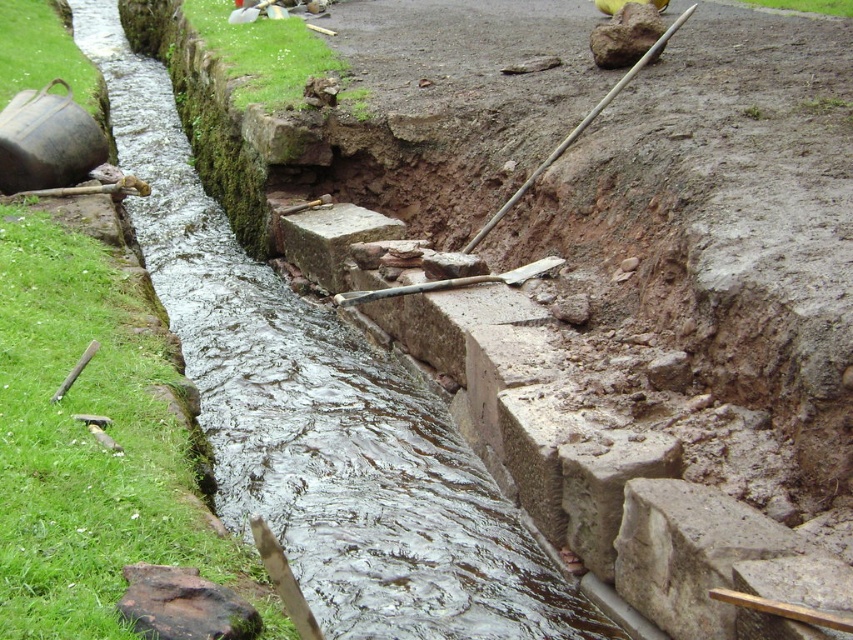
Question: Can you confirm if smooth wooden shovel at upper right is positioned to the right of wooden shovel at center?

Choices:
 (A) no
 (B) yes

Answer: (B)

Question: Which object appears closest to the camera in this image?

Choices:
 (A) wet concrete stream at center
 (B) wooden shovel at center

Answer: (A)

Question: Can you confirm if smooth wooden shovel at upper right is smaller than wooden shovel at center?

Choices:
 (A) yes
 (B) no

Answer: (A)

Question: Estimate the real-world distances between objects in this image. Which object is farther from the wooden shovel at center?

Choices:
 (A) smooth wooden shovel at upper right
 (B) wet concrete stream at center

Answer: (A)

Question: Which object is closer to the camera taking this photo?

Choices:
 (A) wet concrete stream at center
 (B) smooth wooden shovel at upper right

Answer: (A)

Question: Observing the image, what is the correct spatial positioning of smooth wooden shovel at upper right in reference to wooden shovel at center?

Choices:
 (A) below
 (B) above

Answer: (B)